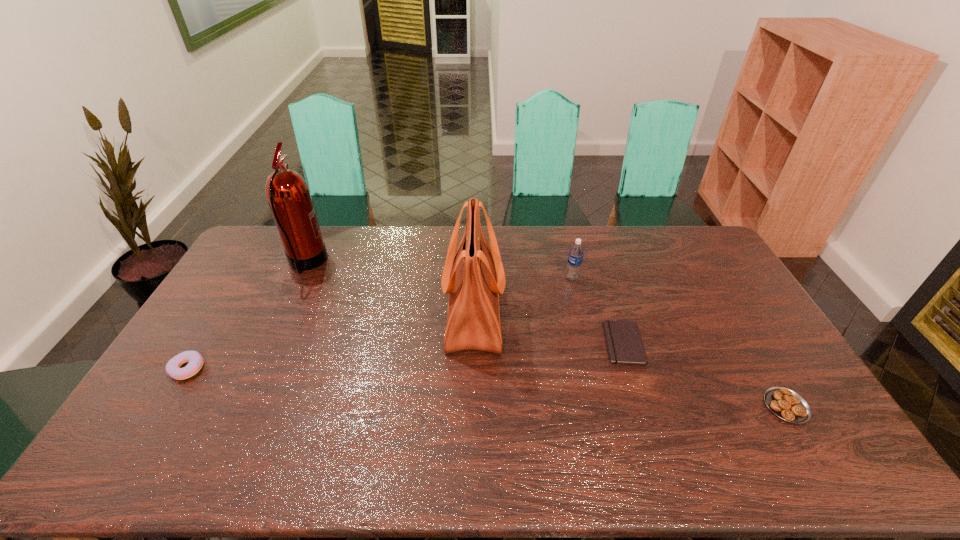
At what (x,y) coordinates should I click in order to perform the action: click on vacant point located between the third object from right to left and the shortest object. Please return your answer as a coordinate pair (x, y). This screenshot has height=540, width=960. Looking at the image, I should click on (598, 311).

At what (x,y) coordinates should I click in order to perform the action: click on vacant area that lies between the water bottle and the rightmost object. Please return your answer as a coordinate pair (x, y). Looking at the image, I should click on (679, 342).

You are a GUI agent. You are given a task and a screenshot of the screen. Output one action in this format:
    pyautogui.click(x=<x>, y=<y>)
    Task: Click on the free space between the third tallest object and the nearest object
    
    Given the screenshot: What is the action you would take?
    pyautogui.click(x=679, y=342)

The width and height of the screenshot is (960, 540). Find the location of `vacant space in between the fifth object from right to left and the pastry`. vacant space in between the fifth object from right to left and the pastry is located at coordinates tap(546, 335).

Choose which object is the fourth nearest neighbor to the third tallest object. Please provide its 2D coordinates. Your answer should be formatted as a tuple, i.e. [(x, y)], where the tuple contains the x and y coordinates of a point satisfying the conditions above.

[(288, 195)]

Find the location of `object that is the closest to the second object from right to left`. object that is the closest to the second object from right to left is located at coordinates (576, 252).

The height and width of the screenshot is (540, 960). I want to click on free space in the image that satisfies the following two spatial constraints: 1. on the front-facing side of the fifth object from right to left; 2. on the right side of the checkbook, so click(x=269, y=343).

Locate an element on the screen. The height and width of the screenshot is (540, 960). vacant space that satisfies the following two spatial constraints: 1. on the front pocket of the shopping bag; 2. on the back side of the shortest object is located at coordinates (473, 343).

The image size is (960, 540). I want to click on blank space that satisfies the following two spatial constraints: 1. on the front pocket of the fifth tallest object; 2. on the right side of the fifth shortest object, so click(x=472, y=406).

What are the coordinates of `vacant position in the image that satisfies the following two spatial constraints: 1. on the front-facing side of the fire extinguisher; 2. on the right side of the fourth shortest object` in the screenshot? It's located at (300, 278).